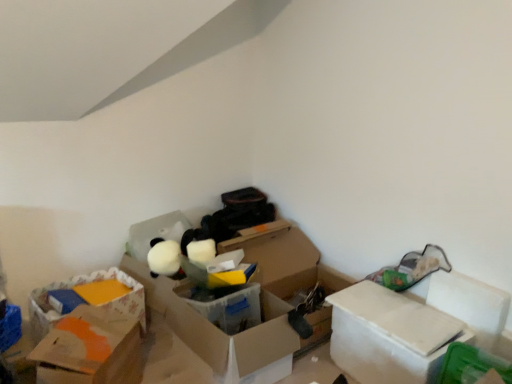
Question: Does white cardboard box at right, the 1th box positioned from the right, lie behind translucent plastic box at center, the second box positioned from the right?

Choices:
 (A) yes
 (B) no

Answer: (B)

Question: Is white cardboard box at right, the third box in the left-to-right sequence, to the left of translucent plastic box at center, which ranks as the second box in left-to-right order, from the viewer's perspective?

Choices:
 (A) no
 (B) yes

Answer: (A)

Question: Is white cardboard box at right, the 1th box positioned from the right, at the right side of translucent plastic box at center, which ranks as the second box in left-to-right order?

Choices:
 (A) no
 (B) yes

Answer: (B)

Question: Is white cardboard box at right, the 1th box positioned from the right, oriented away from translucent plastic box at center, which ranks as the second box in left-to-right order?

Choices:
 (A) no
 (B) yes

Answer: (A)

Question: Is white cardboard box at right, the 1th box positioned from the right, taller than translucent plastic box at center, which ranks as the second box in left-to-right order?

Choices:
 (A) yes
 (B) no

Answer: (A)

Question: From the image's perspective, is orange cardboard box at lower left, positioned as the third box in right-to-left order, positioned above or below translucent plastic box at center, the second box positioned from the right?

Choices:
 (A) above
 (B) below

Answer: (B)

Question: Would you say orange cardboard box at lower left, positioned as the third box in right-to-left order, is inside or outside translucent plastic box at center, the second box positioned from the right?

Choices:
 (A) inside
 (B) outside

Answer: (B)

Question: Is orange cardboard box at lower left, the 1th box in the left-to-right sequence, to the left or to the right of translucent plastic box at center, which ranks as the second box in left-to-right order, in the image?

Choices:
 (A) left
 (B) right

Answer: (A)

Question: Is point (87, 327) closer or farther from the camera than point (282, 332)?

Choices:
 (A) closer
 (B) farther

Answer: (A)

Question: Relative to white cardboard box at right, the 1th box positioned from the right, is translucent plastic box at center, the second box positioned from the right, in front or behind?

Choices:
 (A) behind
 (B) front

Answer: (A)

Question: Based on their sizes in the image, would you say translucent plastic box at center, which ranks as the second box in left-to-right order, is bigger or smaller than white cardboard box at right, the third box in the left-to-right sequence?

Choices:
 (A) small
 (B) big

Answer: (B)

Question: Looking at their shapes, would you say translucent plastic box at center, which ranks as the second box in left-to-right order, is wider or thinner than white cardboard box at right, the 1th box positioned from the right?

Choices:
 (A) thin
 (B) wide

Answer: (B)

Question: From the image's perspective, is translucent plastic box at center, the second box positioned from the right, positioned above or below white cardboard box at right, the third box in the left-to-right sequence?

Choices:
 (A) below
 (B) above

Answer: (B)

Question: Considering the positions of orange cardboard box at lower left, positioned as the third box in right-to-left order, and green plastic storage box at lower right, the 1th storage box when ordered from right to left, in the image, is orange cardboard box at lower left, positioned as the third box in right-to-left order, taller or shorter than green plastic storage box at lower right, the 1th storage box when ordered from right to left,?

Choices:
 (A) tall
 (B) short

Answer: (A)

Question: Is orange cardboard box at lower left, the 1th box in the left-to-right sequence, in front of or behind green plastic storage box at lower right, placed as the 2th storage box when sorted from back to front, in the image?

Choices:
 (A) front
 (B) behind

Answer: (B)